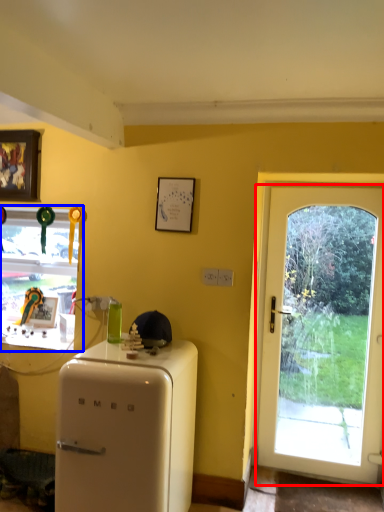
Question: Among these objects, which one is farthest to the camera, door (highlighted by a red box) or window (highlighted by a blue box)?

Choices:
 (A) door
 (B) window

Answer: (B)